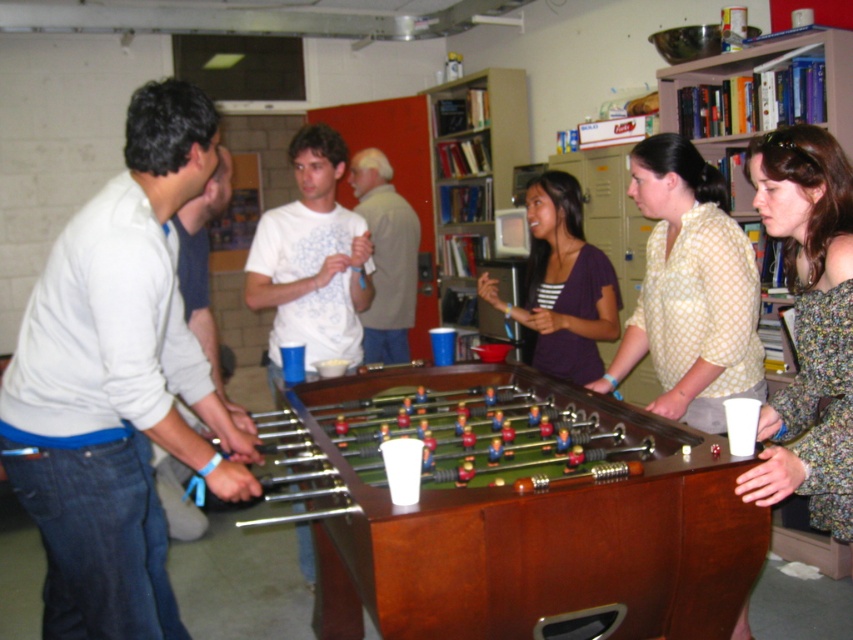
Question: Can you confirm if brown wooden foosball table at center is thinner than wooden bookshelf at upper right?

Choices:
 (A) no
 (B) yes

Answer: (A)

Question: Which of the following is the farthest from the observer?

Choices:
 (A) (399, 266)
 (B) (422, 602)
 (C) (846, 52)
 (D) (724, 193)

Answer: (A)

Question: Does denim jeans at left have a larger size compared to wooden bookshelf at upper right?

Choices:
 (A) no
 (B) yes

Answer: (B)

Question: Among these objects, which one is nearest to the camera?

Choices:
 (A) light brown shirt at center
 (B) wooden bookshelf at upper center

Answer: (A)

Question: Can you confirm if floral-patterned dress at lower right is bigger than matte purple shirt at center?

Choices:
 (A) no
 (B) yes

Answer: (A)

Question: Among these points, which one is nearest to the camera?

Choices:
 (A) (108, 541)
 (B) (482, 298)
 (C) (730, 337)

Answer: (A)